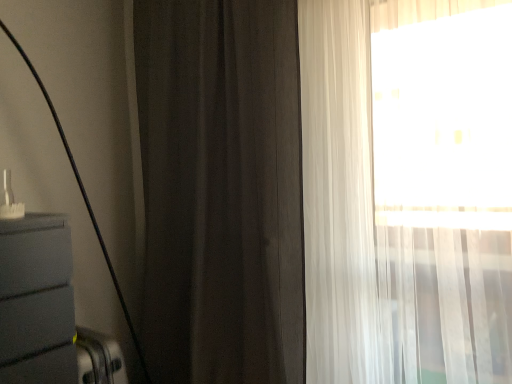
Question: Which direction should I rotate to look at dark matte curtain at center, which is the second curtain in right-to-left order?

Choices:
 (A) left
 (B) right

Answer: (A)

Question: Does sheer white curtain at right, which is counted as the 1th curtain, starting from the right, appear on the right side of dark matte curtain at center, which is the second curtain in right-to-left order?

Choices:
 (A) no
 (B) yes

Answer: (B)

Question: Can you confirm if sheer white curtain at right, which is counted as the 1th curtain, starting from the right, is thinner than dark matte curtain at center, acting as the first curtain starting from the left?

Choices:
 (A) yes
 (B) no

Answer: (B)

Question: Can you confirm if sheer white curtain at right, the second curtain when ordered from left to right, is bigger than dark matte curtain at center, acting as the first curtain starting from the left?

Choices:
 (A) no
 (B) yes

Answer: (A)

Question: Does sheer white curtain at right, the second curtain when ordered from left to right, have a smaller size compared to dark matte curtain at center, which is the second curtain in right-to-left order?

Choices:
 (A) yes
 (B) no

Answer: (A)

Question: Considering the relative sizes of sheer white curtain at right, the second curtain when ordered from left to right, and dark matte curtain at center, acting as the first curtain starting from the left, in the image provided, is sheer white curtain at right, the second curtain when ordered from left to right, wider than dark matte curtain at center, acting as the first curtain starting from the left,?

Choices:
 (A) no
 (B) yes

Answer: (B)

Question: Considering the relative sizes of sheer white curtain at right, the second curtain when ordered from left to right, and dark matte curtain at center, acting as the first curtain starting from the left, in the image provided, is sheer white curtain at right, the second curtain when ordered from left to right, shorter than dark matte curtain at center, acting as the first curtain starting from the left,?

Choices:
 (A) no
 (B) yes

Answer: (B)

Question: Is sheer white curtain at right, the second curtain when ordered from left to right, surrounded by dark matte curtain at center, acting as the first curtain starting from the left?

Choices:
 (A) yes
 (B) no

Answer: (B)

Question: Is dark matte curtain at center, which is the second curtain in right-to-left order, at the left side of sheer white curtain at right, the second curtain when ordered from left to right?

Choices:
 (A) no
 (B) yes

Answer: (B)

Question: Is dark matte curtain at center, which is the second curtain in right-to-left order, at the right side of sheer white curtain at right, the second curtain when ordered from left to right?

Choices:
 (A) no
 (B) yes

Answer: (A)

Question: From a real-world perspective, is dark matte curtain at center, acting as the first curtain starting from the left, positioned under sheer white curtain at right, the second curtain when ordered from left to right, based on gravity?

Choices:
 (A) no
 (B) yes

Answer: (A)

Question: Is dark matte curtain at center, acting as the first curtain starting from the left, with sheer white curtain at right, which is counted as the 1th curtain, starting from the right?

Choices:
 (A) no
 (B) yes

Answer: (A)

Question: Can you confirm if dark matte curtain at center, acting as the first curtain starting from the left, is bigger than sheer white curtain at right, the second curtain when ordered from left to right?

Choices:
 (A) no
 (B) yes

Answer: (B)

Question: From a real-world perspective, is sheer white curtain at right, the second curtain when ordered from left to right, above or below dark matte curtain at center, which is the second curtain in right-to-left order?

Choices:
 (A) below
 (B) above

Answer: (A)